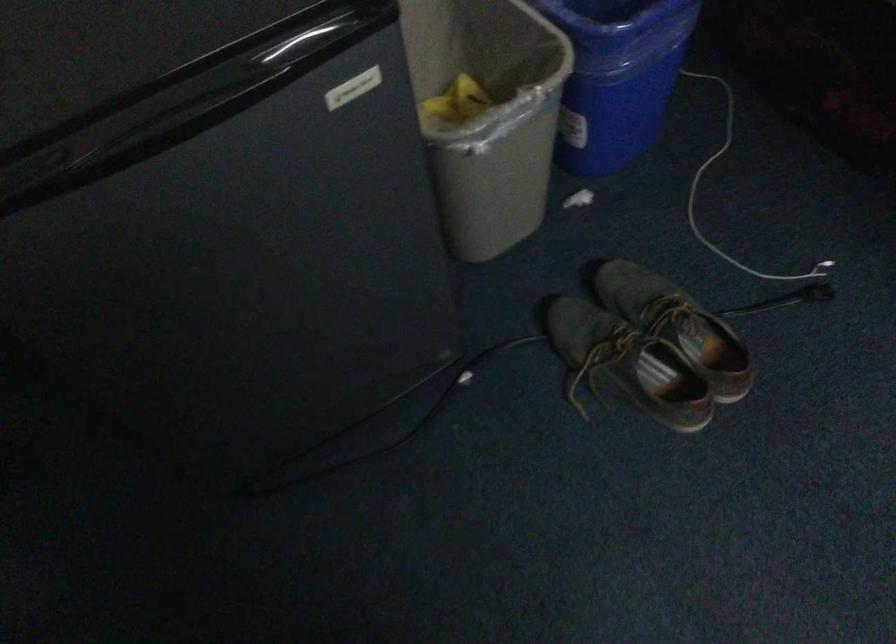
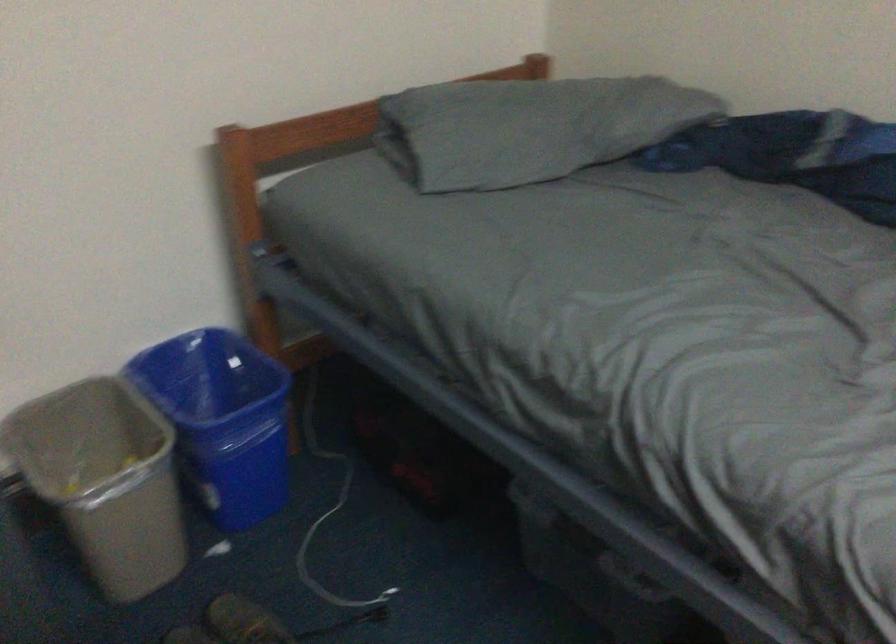
In the second image, find the point that corresponds to point 494,114 in the first image.

(104, 480)